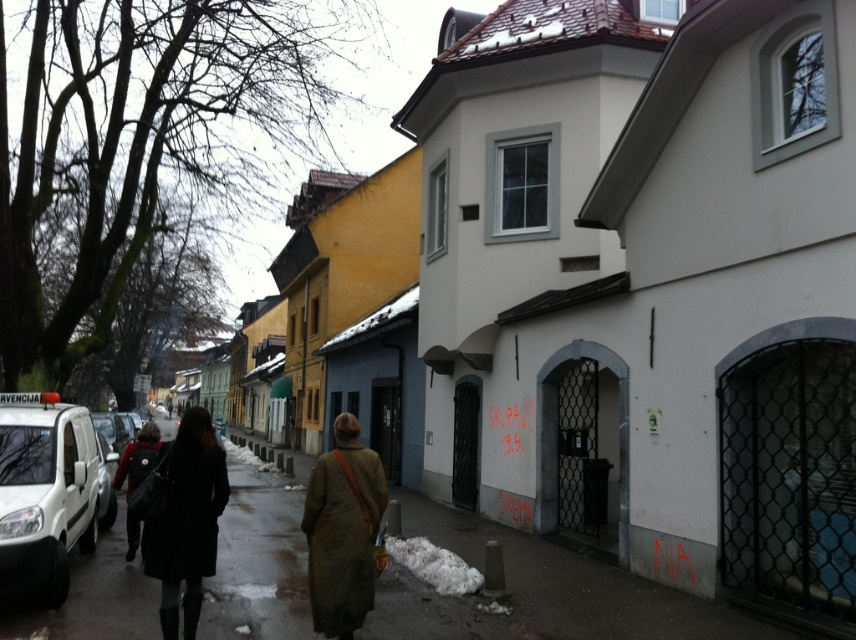
Question: Is white matte van at left wider than black matte coat at center?

Choices:
 (A) yes
 (B) no

Answer: (B)

Question: Which object is farther from the camera taking this photo?

Choices:
 (A) white glossy van at left
 (B) matte black coat at lower left
 (C) white matte van at left
 (D) green wool coat at center

Answer: (A)

Question: Does smooth asphalt sidewalk at lower center have a greater width compared to matte black coat at lower left?

Choices:
 (A) no
 (B) yes

Answer: (B)

Question: Which object is closer to the camera taking this photo?

Choices:
 (A) white glossy van at left
 (B) green wool coat at center
 (C) black matte coat at center

Answer: (C)

Question: Is black matte coat at center thinner than white glossy van at left?

Choices:
 (A) yes
 (B) no

Answer: (A)

Question: Which point is closer to the camera?

Choices:
 (A) white matte van at left
 (B) white glossy van at left
 (C) black matte coat at center

Answer: (C)